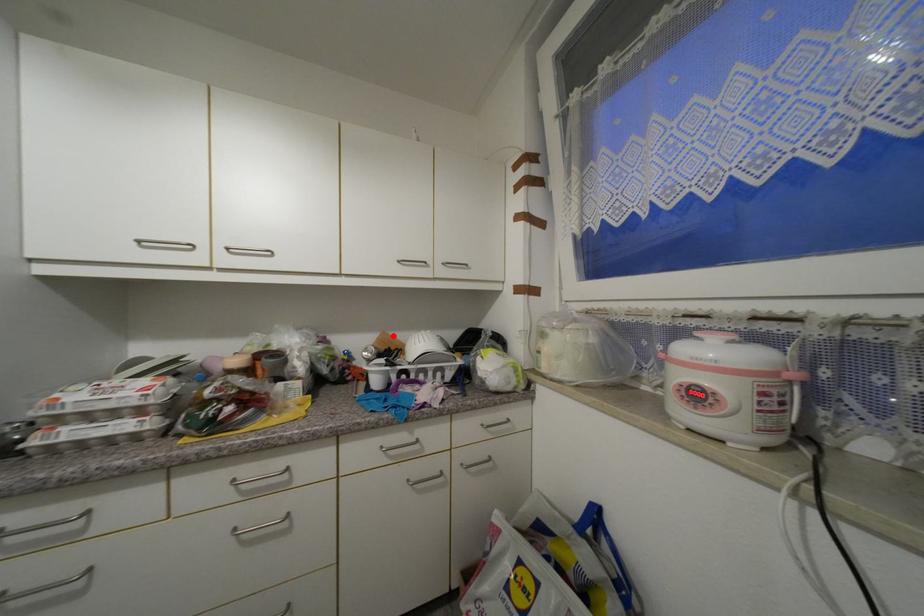
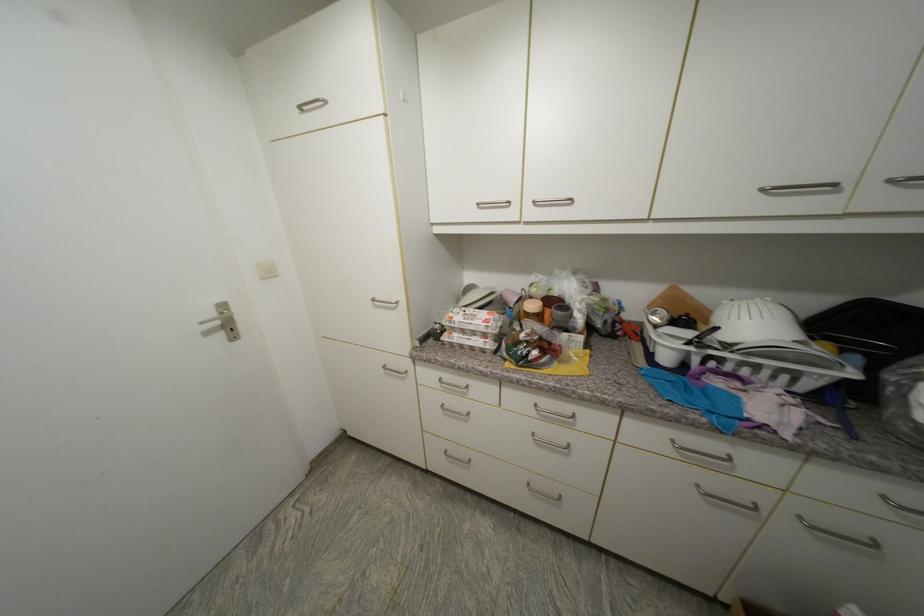
Find the pixel in the second image that matches the highlighted location in the first image.

(685, 292)